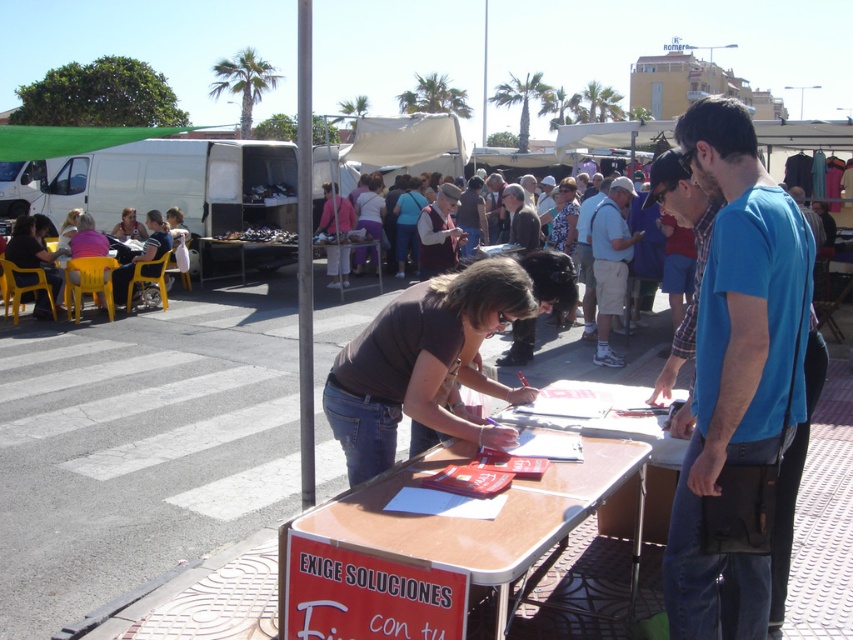
Question: Which of the following is the farthest from the observer?

Choices:
 (A) matte pink chair at left
 (B) light blue shirt at center

Answer: (A)

Question: Does pink fabric pants at center appear under matte brown shirt at center?

Choices:
 (A) yes
 (B) no

Answer: (A)

Question: Which point is closer to the camera taking this photo?

Choices:
 (A) (593, 252)
 (B) (393, 561)
 (C) (521, 202)

Answer: (B)

Question: Which object is farther from the camera taking this photo?

Choices:
 (A) matte black shirt at left
 (B) matte pink chair at left
 (C) matte blue jeans at center

Answer: (C)

Question: Does matte black shirt at left appear on the left side of matte brown shirt at center?

Choices:
 (A) yes
 (B) no

Answer: (A)

Question: In this image, where is dark brown leather jacket at center located relative to matte pink chair at left?

Choices:
 (A) right
 (B) left

Answer: (A)